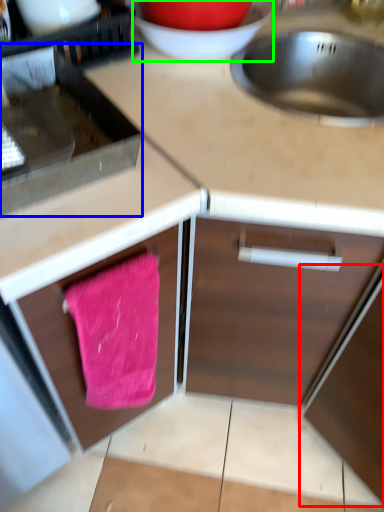
Question: Estimate the real-world distances between objects in this image. Which object is farther from appliance (highlighted by a red box), appliance (highlighted by a blue box) or basin (highlighted by a green box)?

Choices:
 (A) appliance
 (B) basin

Answer: (B)